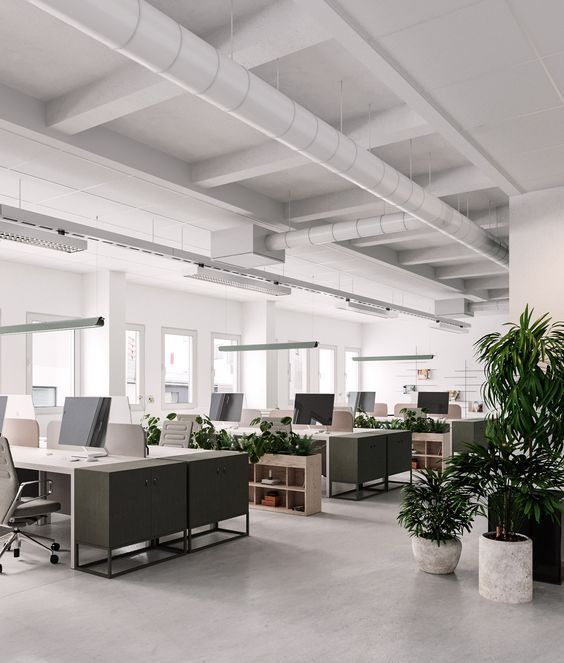
Locate an element on the screen. The height and width of the screenshot is (663, 564). cabinets is located at coordinates (127, 516), (160, 504), (202, 489), (236, 481), (378, 459), (402, 453), (474, 435), (503, 431).